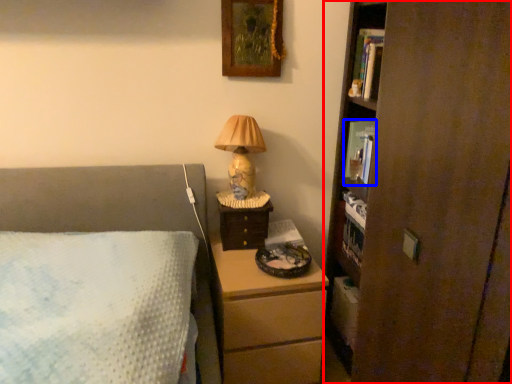
Question: Which point is closer to the camera, bookcase (highlighted by a red box) or book (highlighted by a blue box)?

Choices:
 (A) bookcase
 (B) book

Answer: (A)